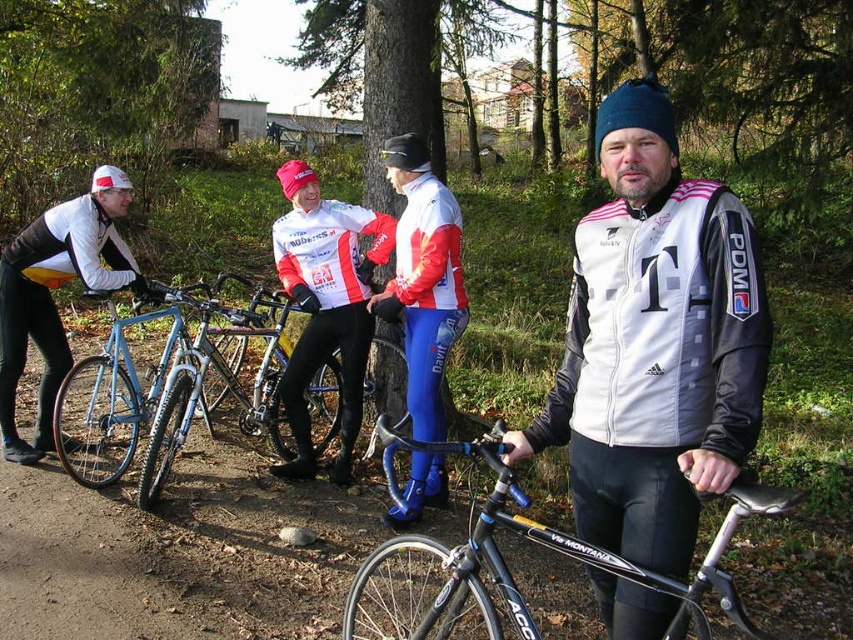
Question: Estimate the real-world distances between objects in this image. Which object is farther from the matte blue cycling suit at center?

Choices:
 (A) matte black bicycle at left
 (B) white jersey at center
 (C) black matte bicycle at center

Answer: (A)

Question: Estimate the real-world distances between objects in this image. Which object is farther from the matte blue cycling suit at center?

Choices:
 (A) black matte bicycle at center
 (B) shiny blue frame at center
 (C) white jersey at center

Answer: (A)

Question: Can you confirm if matte blue cycling suit at center is positioned below blue metallic bicycle at left?

Choices:
 (A) no
 (B) yes

Answer: (A)

Question: Is black matte bicycle at center wider than matte blue cycling suit at center?

Choices:
 (A) no
 (B) yes

Answer: (B)

Question: Which is nearer to the matte blue cycling suit at center?

Choices:
 (A) shiny blue frame at center
 (B) blue metallic bicycle at left
 (C) white jersey at center
 (D) black matte bicycle at center

Answer: (C)

Question: Considering the relative positions of black matte bicycle at center and shiny blue frame at center in the image provided, where is black matte bicycle at center located with respect to shiny blue frame at center?

Choices:
 (A) left
 (B) right

Answer: (B)